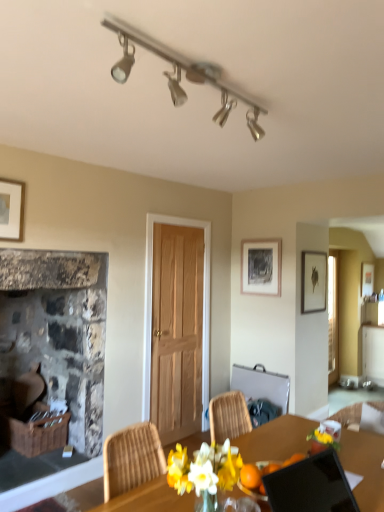
Question: Is black glossy laptop at lower right to the left of matte black picture frame at upper center, the second picture frame viewed from the right, from the viewer's perspective?

Choices:
 (A) yes
 (B) no

Answer: (A)

Question: Is black glossy laptop at lower right positioned behind matte black picture frame at upper center, placed as the first picture frame when sorted from left to right?

Choices:
 (A) yes
 (B) no

Answer: (B)

Question: From the image's perspective, is black glossy laptop at lower right beneath matte black picture frame at upper center, placed as the first picture frame when sorted from left to right?

Choices:
 (A) no
 (B) yes

Answer: (B)

Question: Could matte black picture frame at upper center, placed as the first picture frame when sorted from left to right, be considered to be inside black glossy laptop at lower right?

Choices:
 (A) no
 (B) yes

Answer: (A)

Question: From a real-world perspective, is black glossy laptop at lower right over matte black picture frame at upper center, placed as the first picture frame when sorted from left to right?

Choices:
 (A) yes
 (B) no

Answer: (B)

Question: Do you think metallic silver chair at center is within wooden table at center, or outside of it?

Choices:
 (A) inside
 (B) outside

Answer: (B)

Question: From the image's perspective, is metallic silver chair at center above or below wooden table at center?

Choices:
 (A) above
 (B) below

Answer: (B)

Question: Is metallic silver chair at center wider or thinner than wooden table at center?

Choices:
 (A) wide
 (B) thin

Answer: (B)

Question: Is metallic silver chair at center in front of or behind wooden table at center in the image?

Choices:
 (A) front
 (B) behind

Answer: (B)

Question: From a real-world perspective, relative to matte black picture frame at upper center, placed as the first picture frame when sorted from left to right, is metallic silver chair at center vertically above or below?

Choices:
 (A) above
 (B) below

Answer: (B)

Question: Considering the positions of metallic silver chair at center and matte black picture frame at upper center, the second picture frame viewed from the right, in the image, is metallic silver chair at center wider or thinner than matte black picture frame at upper center, the second picture frame viewed from the right,?

Choices:
 (A) thin
 (B) wide

Answer: (B)

Question: Is point (246, 374) positioned closer to the camera than point (271, 285)?

Choices:
 (A) closer
 (B) farther

Answer: (B)

Question: Relative to matte black picture frame at upper center, the second picture frame viewed from the right, is metallic silver chair at center in front or behind?

Choices:
 (A) front
 (B) behind

Answer: (A)

Question: Is metallic silver chair at center inside the boundaries of rustic stone fireplace at left, or outside?

Choices:
 (A) outside
 (B) inside

Answer: (A)

Question: Is metallic silver chair at center wider or thinner than rustic stone fireplace at left?

Choices:
 (A) thin
 (B) wide

Answer: (A)